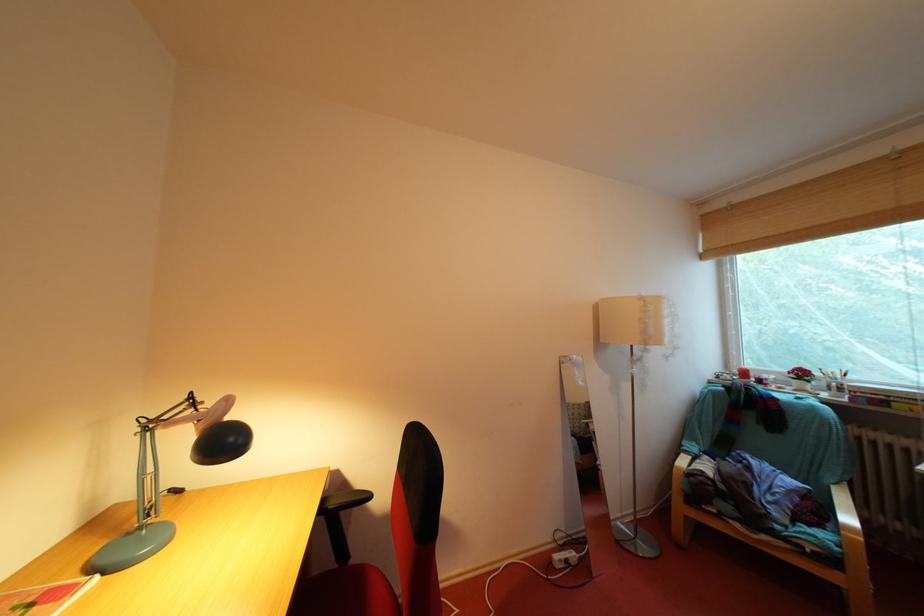
Locate an element on the screen. red notebook is located at coordinates (44, 598).